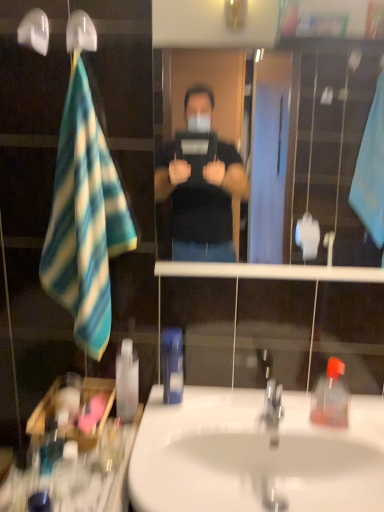
The image size is (384, 512). Identify the location of free space in front of translucent plastic mouthwash at lower left, placed as the third mouthwash when sorted from front to back. (99, 459).